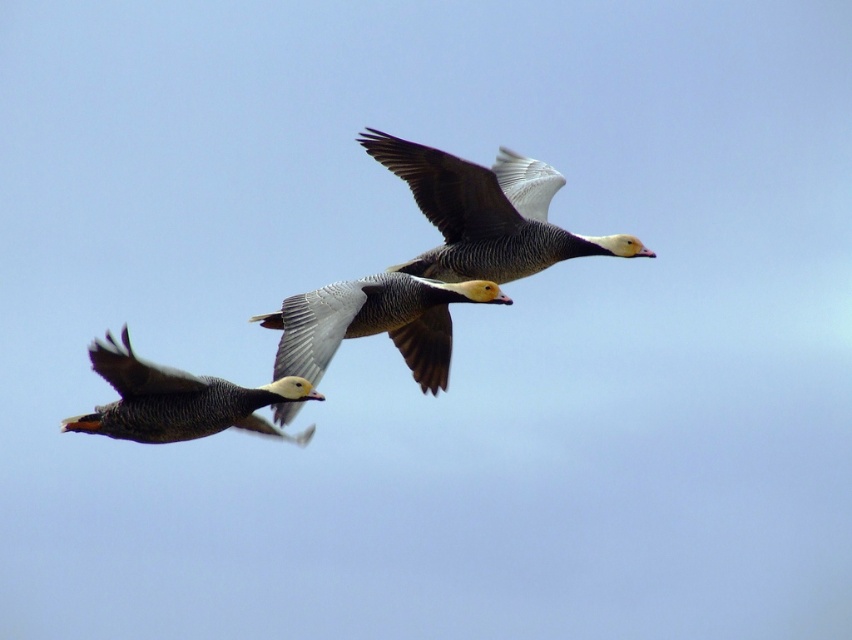
Question: Which object is the closest to the speckled feathered goose at left?

Choices:
 (A) speckled feathered goose at upper center
 (B) speckled feathered duck at center

Answer: (B)

Question: Which object is farther from the camera taking this photo?

Choices:
 (A) speckled feathered goose at upper center
 (B) speckled feathered duck at center
 (C) speckled feathered goose at left

Answer: (A)

Question: Is speckled feathered goose at upper center positioned at the back of speckled feathered duck at center?

Choices:
 (A) yes
 (B) no

Answer: (A)

Question: Is speckled feathered goose at upper center below speckled feathered duck at center?

Choices:
 (A) yes
 (B) no

Answer: (B)

Question: Does speckled feathered goose at upper center have a lesser width compared to speckled feathered duck at center?

Choices:
 (A) no
 (B) yes

Answer: (A)

Question: Among these points, which one is farthest from the camera?

Choices:
 (A) (209, 403)
 (B) (401, 168)
 (C) (419, 380)

Answer: (C)